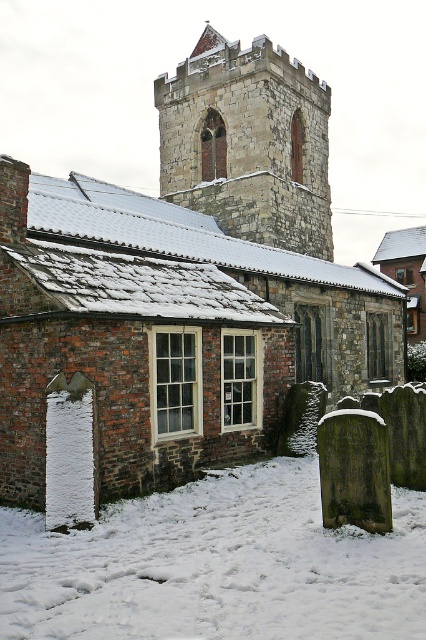
Who is positioned more to the left, white powdery snow at lower center or stone tower at upper center?

From the viewer's perspective, stone tower at upper center appears more on the left side.

Is white powdery snow at lower center in front of stone tower at upper center?

Yes.

Does point (103, 550) come behind point (278, 177)?

No.

At what (x,y) coordinates should I click in order to perform the action: click on white powdery snow at lower center. Please return your answer as a coordinate pair (x, y). This screenshot has width=426, height=640. Looking at the image, I should click on (216, 564).